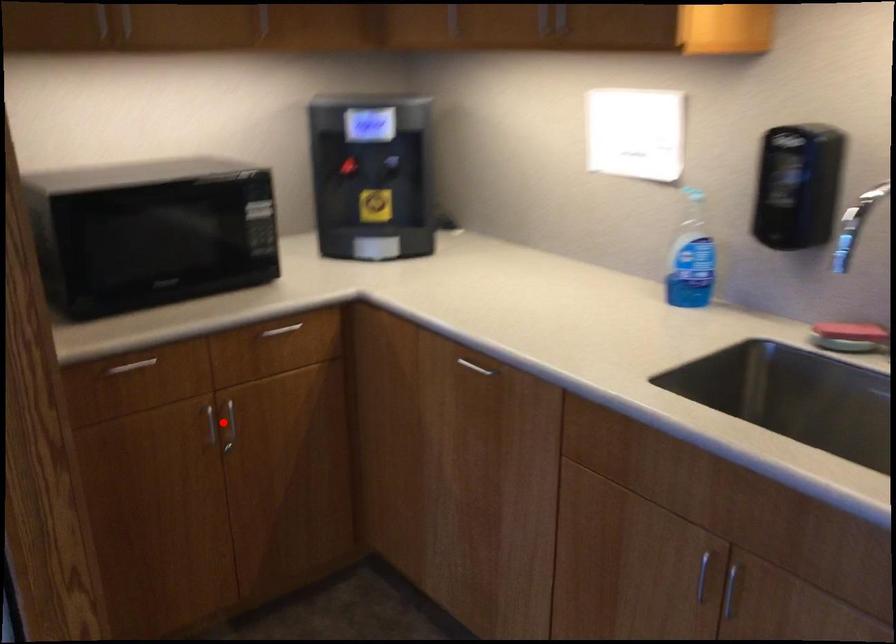
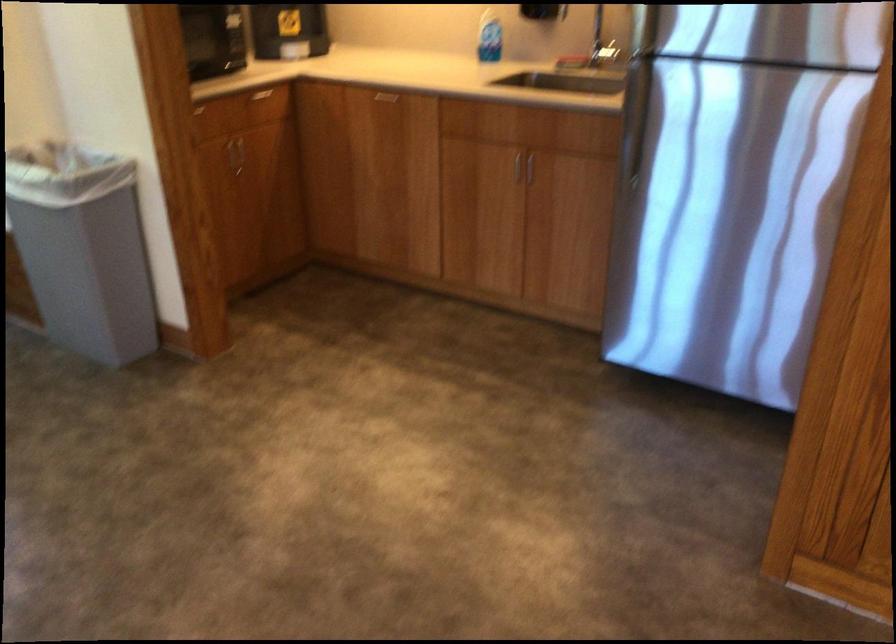
The point at the highlighted location is marked in the first image. Where is the corresponding point in the second image?

(234, 153)